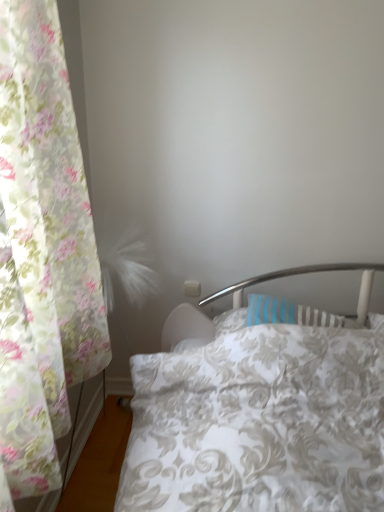
Question: Is floral sheer curtain at left facing away from white floral duvet at center?

Choices:
 (A) no
 (B) yes

Answer: (A)

Question: From a real-world perspective, is floral sheer curtain at left beneath white floral duvet at center?

Choices:
 (A) no
 (B) yes

Answer: (A)

Question: Is the surface of floral sheer curtain at left in direct contact with white floral duvet at center?

Choices:
 (A) yes
 (B) no

Answer: (B)

Question: Is there a large distance between floral sheer curtain at left and white floral duvet at center?

Choices:
 (A) yes
 (B) no

Answer: (B)

Question: Is floral sheer curtain at left further to camera compared to white floral duvet at center?

Choices:
 (A) no
 (B) yes

Answer: (A)

Question: Can you confirm if floral sheer curtain at left is taller than white floral duvet at center?

Choices:
 (A) no
 (B) yes

Answer: (B)

Question: Can you confirm if white floral duvet at center is thinner than floral sheer curtain at left?

Choices:
 (A) yes
 (B) no

Answer: (B)

Question: Considering the relative positions of white floral duvet at center and floral sheer curtain at left in the image provided, is white floral duvet at center to the right of floral sheer curtain at left from the viewer's perspective?

Choices:
 (A) no
 (B) yes

Answer: (B)

Question: Can you confirm if white floral duvet at center is shorter than floral sheer curtain at left?

Choices:
 (A) yes
 (B) no

Answer: (A)

Question: Is white floral duvet at center at the left side of floral sheer curtain at left?

Choices:
 (A) yes
 (B) no

Answer: (B)

Question: From a real-world perspective, is white floral duvet at center beneath floral sheer curtain at left?

Choices:
 (A) no
 (B) yes

Answer: (B)

Question: Are white floral duvet at center and floral sheer curtain at left making contact?

Choices:
 (A) no
 (B) yes

Answer: (A)

Question: Is white floral duvet at center wider or thinner than floral sheer curtain at left?

Choices:
 (A) thin
 (B) wide

Answer: (B)